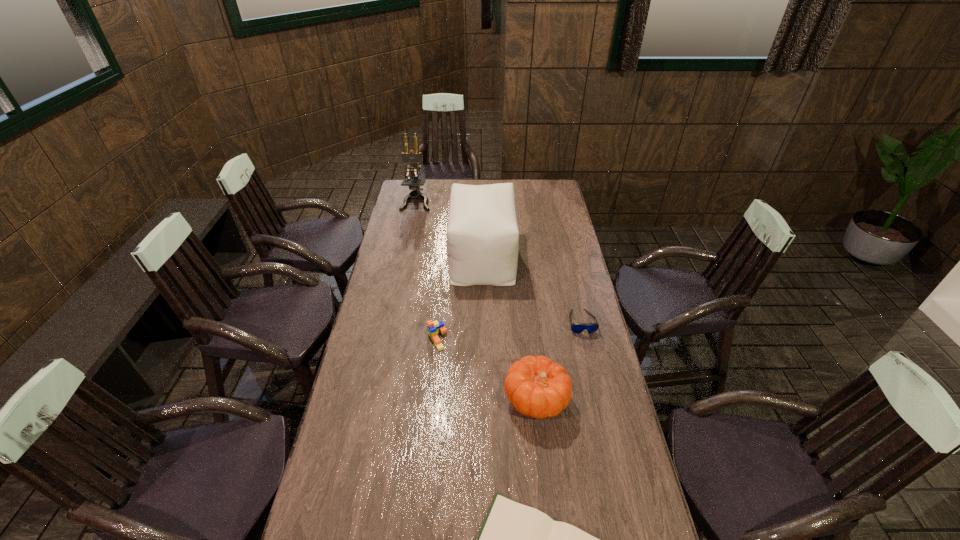
Identify the location of free space located 0.060m on the side of the second tallest object with the smiley face. The height and width of the screenshot is (540, 960). (436, 257).

Where is `free space located on the side of the second tallest object with the smiley face`? The width and height of the screenshot is (960, 540). free space located on the side of the second tallest object with the smiley face is located at coordinates (415, 257).

Locate an element on the screen. Image resolution: width=960 pixels, height=540 pixels. vacant space located on the front of the third tallest object is located at coordinates (549, 519).

Identify the location of vacant position located on the right of the Lego. This screenshot has height=540, width=960. (502, 339).

You are a GUI agent. You are given a task and a screenshot of the screen. Output one action in this format:
    pyautogui.click(x=<x>, y=<y>)
    Task: Click on the vacant region located on the front-facing side of the sunglasses
    Image resolution: width=960 pixels, height=540 pixels.
    Given the screenshot: What is the action you would take?
    pyautogui.click(x=605, y=423)

This screenshot has width=960, height=540. In order to click on object located in the far edge section of the desktop in this screenshot , I will do `click(413, 157)`.

This screenshot has height=540, width=960. What are the coordinates of `object present at the left edge` in the screenshot? It's located at (413, 157).

Locate an element on the screen. This screenshot has width=960, height=540. pumpkin located at the right edge is located at coordinates (537, 387).

Image resolution: width=960 pixels, height=540 pixels. I want to click on sunglasses that is positioned at the right edge, so click(x=577, y=328).

Locate an element on the screen. object situated at the far left corner is located at coordinates (413, 157).